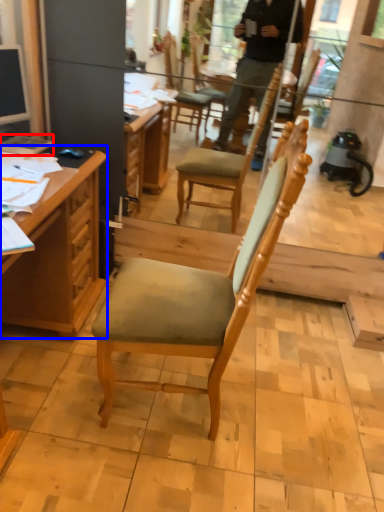
Question: Among these objects, which one is farthest to the camera, book (highlighted by a red box) or desk (highlighted by a blue box)?

Choices:
 (A) book
 (B) desk

Answer: (A)